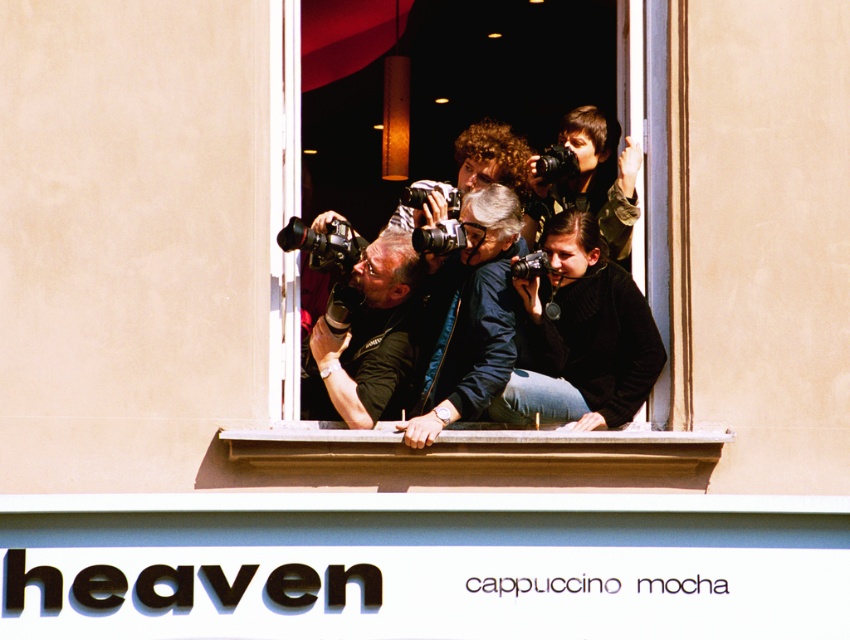
Question: Can you confirm if transparent glass window at center is thinner than smooth concrete window sill at center?

Choices:
 (A) no
 (B) yes

Answer: (B)

Question: Estimate the real-world distances between objects in this image. Which object is closer to the transparent glass window at center?

Choices:
 (A) blue fabric jacket at center
 (B) smooth concrete window sill at center

Answer: (B)

Question: Is blue fabric jacket at center bigger than matte black camera at center?

Choices:
 (A) no
 (B) yes

Answer: (B)

Question: Among these points, which one is nearest to the camera?

Choices:
 (A) (627, 435)
 (B) (486, 227)
 (C) (286, 456)

Answer: (C)

Question: In this image, where is blue fabric jacket at center located relative to matte black camera at center?

Choices:
 (A) left
 (B) right

Answer: (B)

Question: Which object appears farthest from the camera in this image?

Choices:
 (A) blue fabric jacket at center
 (B) smooth concrete window sill at center
 (C) transparent glass window at center
 (D) matte black camera at center

Answer: (D)